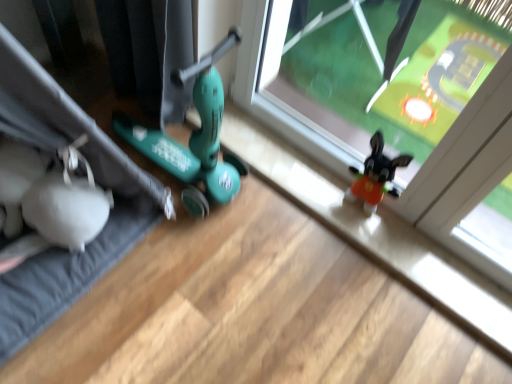
Question: Does point (331, 119) appear closer or farther from the camera than point (49, 266)?

Choices:
 (A) closer
 (B) farther

Answer: (B)

Question: Is transparent plastic window at center inside the boundaries of white fabric yoga mat at left, or outside?

Choices:
 (A) outside
 (B) inside

Answer: (A)

Question: Is transparent plastic window at center in front of or behind white fabric yoga mat at left in the image?

Choices:
 (A) behind
 (B) front

Answer: (A)

Question: Considering the positions of white fabric yoga mat at left and transparent plastic window at center in the image, is white fabric yoga mat at left wider or thinner than transparent plastic window at center?

Choices:
 (A) thin
 (B) wide

Answer: (B)

Question: Looking at the image, does white fabric yoga mat at left seem bigger or smaller compared to transparent plastic window at center?

Choices:
 (A) small
 (B) big

Answer: (B)

Question: From the image's perspective, is white fabric yoga mat at left positioned above or below transparent plastic window at center?

Choices:
 (A) below
 (B) above

Answer: (A)

Question: Is white fabric yoga mat at left in front of or behind transparent plastic window at center in the image?

Choices:
 (A) front
 (B) behind

Answer: (A)